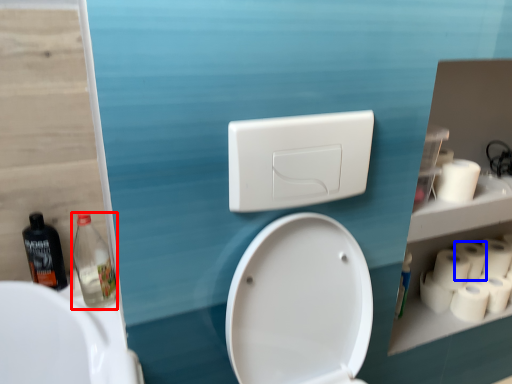
Question: Which object appears farthest to the camera in this image, bottle (highlighted by a red box) or toilet paper (highlighted by a blue box)?

Choices:
 (A) bottle
 (B) toilet paper

Answer: (B)